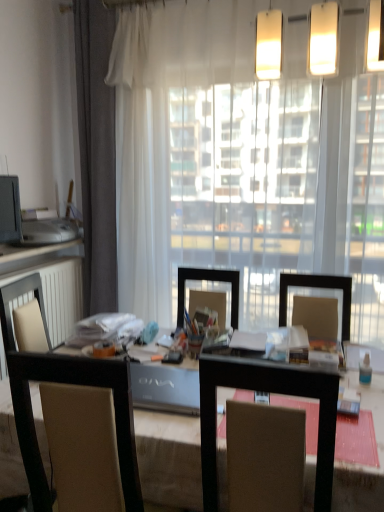
Question: Is brown fabric chair at center outside of matte white countertop at left?

Choices:
 (A) no
 (B) yes

Answer: (B)

Question: Is brown fabric chair at center facing away from matte white countertop at left?

Choices:
 (A) no
 (B) yes

Answer: (A)

Question: Considering the relative sizes of brown fabric chair at center and matte white countertop at left in the image provided, is brown fabric chair at center smaller than matte white countertop at left?

Choices:
 (A) yes
 (B) no

Answer: (B)

Question: Does brown fabric chair at center appear on the left side of matte white countertop at left?

Choices:
 (A) yes
 (B) no

Answer: (B)

Question: Is brown fabric chair at center oriented towards matte white countertop at left?

Choices:
 (A) yes
 (B) no

Answer: (B)

Question: Considering the relative sizes of brown fabric chair at center and matte white countertop at left in the image provided, is brown fabric chair at center taller than matte white countertop at left?

Choices:
 (A) no
 (B) yes

Answer: (B)

Question: From a real-world perspective, is matte white countertop at left below white matte radiator at left?

Choices:
 (A) yes
 (B) no

Answer: (B)

Question: Is matte white countertop at left not within white matte radiator at left?

Choices:
 (A) yes
 (B) no

Answer: (A)

Question: Is matte white countertop at left in contact with white matte radiator at left?

Choices:
 (A) no
 (B) yes

Answer: (A)

Question: Can you confirm if matte white countertop at left is wider than white matte radiator at left?

Choices:
 (A) no
 (B) yes

Answer: (A)

Question: Is matte white countertop at left to the left of white matte radiator at left from the viewer's perspective?

Choices:
 (A) yes
 (B) no

Answer: (A)

Question: From the image's perspective, is matte white countertop at left beneath white matte radiator at left?

Choices:
 (A) no
 (B) yes

Answer: (A)

Question: From a real-world perspective, is brown fabric chair at center positioned over transparent curtain at center based on gravity?

Choices:
 (A) yes
 (B) no

Answer: (B)